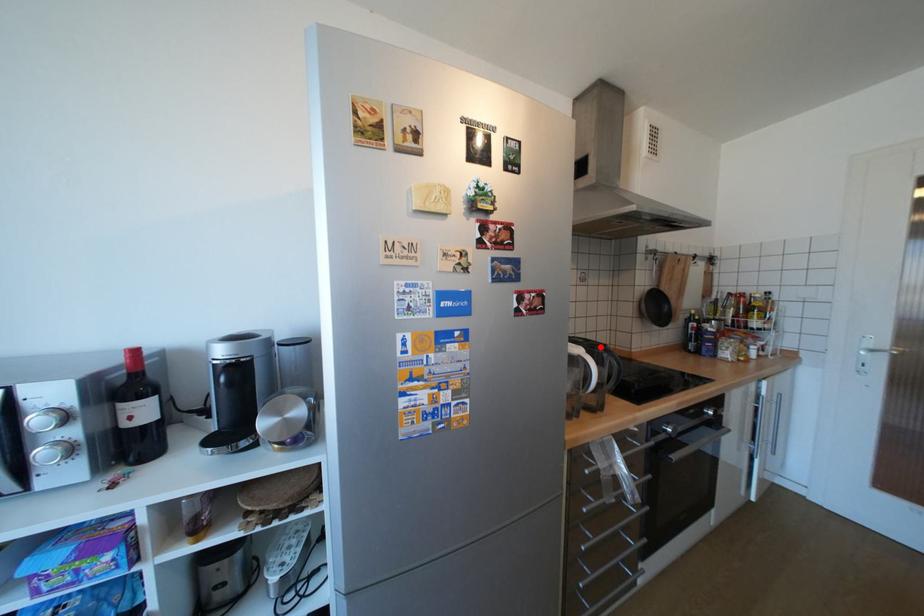
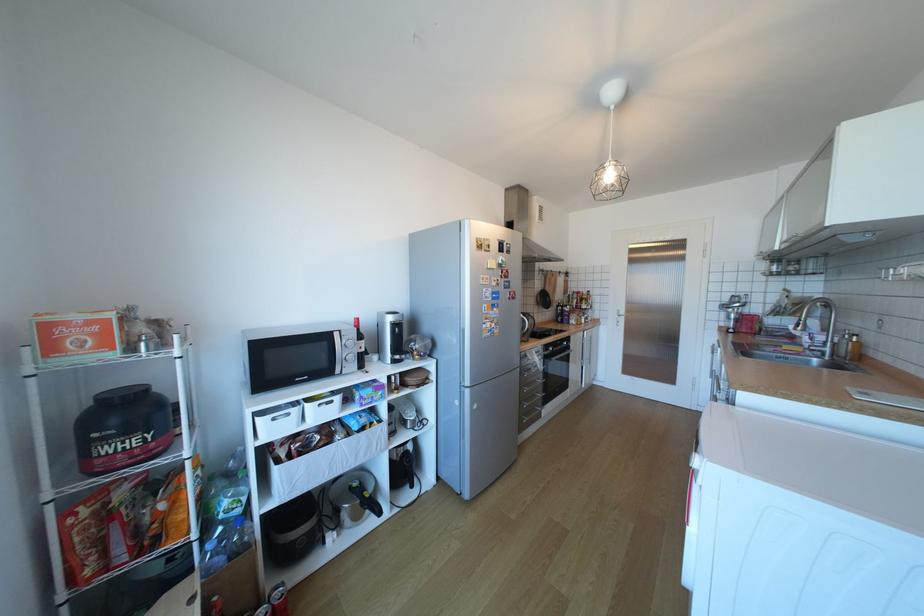
The point at the highlighted location is marked in the first image. Where is the corresponding point in the second image?

(532, 314)